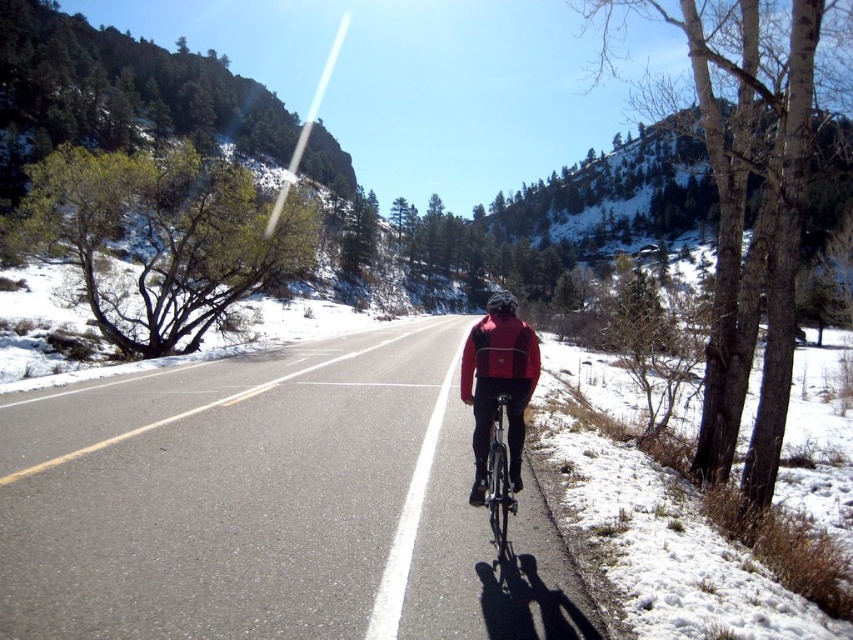
Which is above, matte red jacket at center or shiny metallic bicycle at center?

matte red jacket at center

Which is behind, point (480, 333) or point (486, 476)?

Positioned behind is point (486, 476).

Is point (491, 372) positioned in front of point (498, 484)?

Yes, point (491, 372) is closer to viewer.

Locate an element on the screen. The width and height of the screenshot is (853, 640). matte red jacket at center is located at coordinates (498, 355).

Does point (515, 461) come in front of point (502, 525)?

No, (515, 461) is behind (502, 525).

Does red matte jacket at center appear on the left side of shiny metallic bicycle at center?

Incorrect, red matte jacket at center is not on the left side of shiny metallic bicycle at center.

Is point (497, 362) positioned before point (497, 400)?

Yes.

I want to click on red matte jacket at center, so click(498, 388).

Is red matte jacket at center smaller than matte black helmet at center?

Correct, red matte jacket at center occupies less space than matte black helmet at center.

Is red matte jacket at center above matte black helmet at center?

No, red matte jacket at center is not above matte black helmet at center.

Which is in front, point (531, 358) or point (509, 307)?

Point (531, 358)

Identify the location of red matte jacket at center. (498, 388).